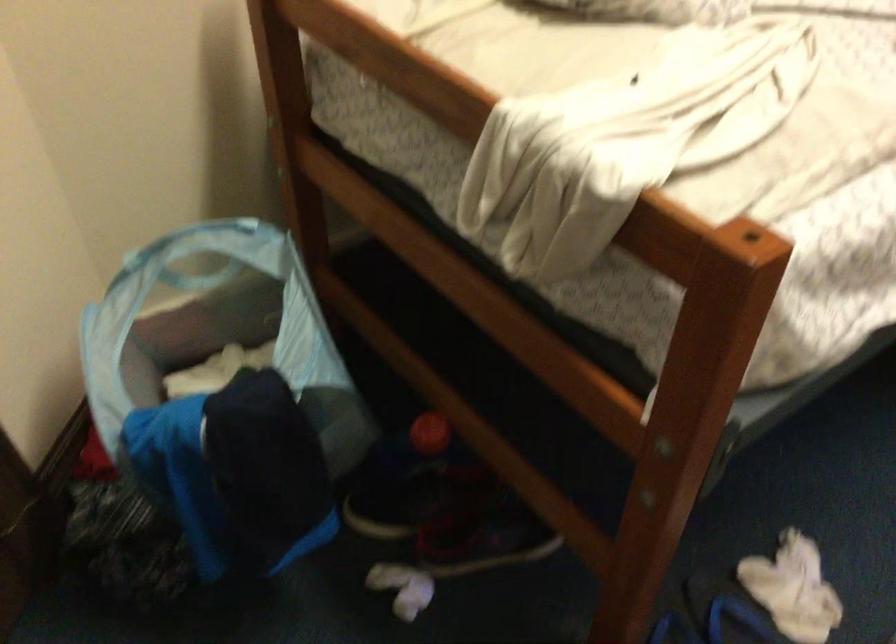
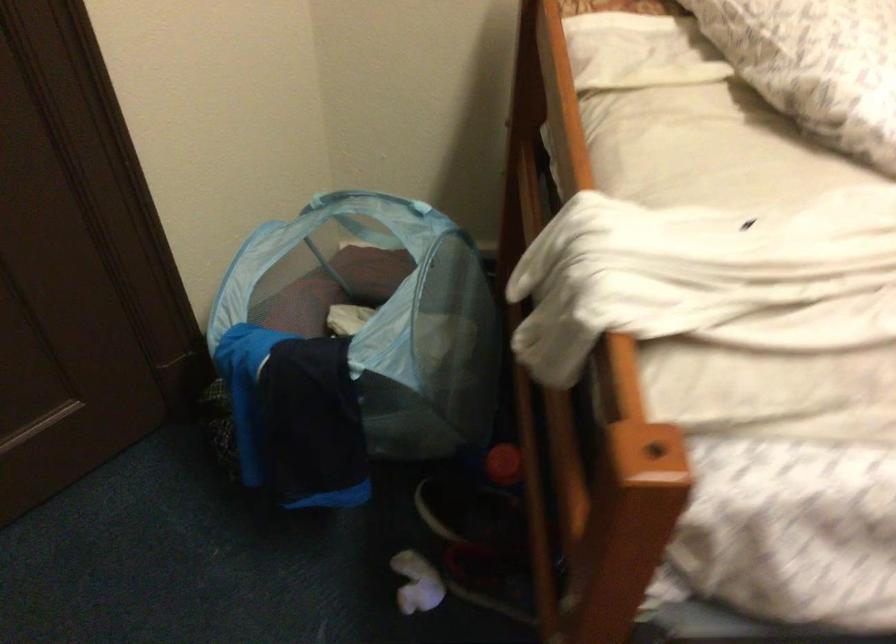
Find the pixel in the second image that matches (x=433, y=431) in the first image.

(504, 464)